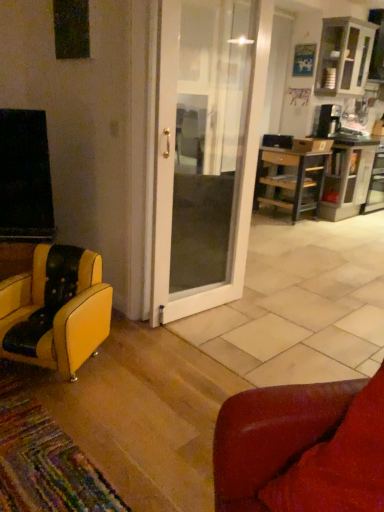
Question: From a real-world perspective, is wooden cabinet at right positioned above or below wooden desk at right?

Choices:
 (A) above
 (B) below

Answer: (A)

Question: Considering their positions, is wooden cabinet at right located in front of or behind wooden desk at right?

Choices:
 (A) front
 (B) behind

Answer: (B)

Question: Based on their relative distances, which object is farther from the leather couch at lower right, which is counted as the second chair, starting from the left?

Choices:
 (A) yellow leather chair at lower left, the 1th chair when ordered from left to right
 (B) wooden desk at right
 (C) white glossy cabinet at upper right
 (D) wooden cabinet at right

Answer: (C)

Question: Which is farther from the white glossy cabinet at upper right?

Choices:
 (A) wooden desk at right
 (B) wooden cabinet at right
 (C) leather couch at lower right, positioned as the 1th chair in right-to-left order
 (D) yellow leather chair at lower left, which is counted as the first chair, starting from the back

Answer: (C)